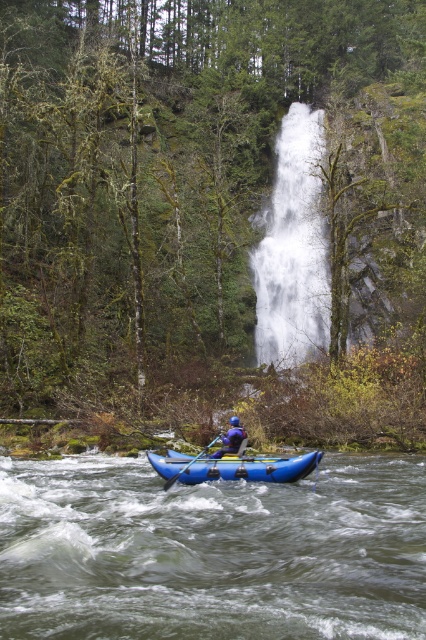
You are a photographer trying to capture the blue rubber raft at lower center and the white frothy water at center in a single shot. Based on their positions, which object should you focus on first to ensure both are in frame?

The blue rubber raft at lower center is to the left of white frothy water at center, so you should focus on the blue rubber raft at lower center first to ensure both are in frame.